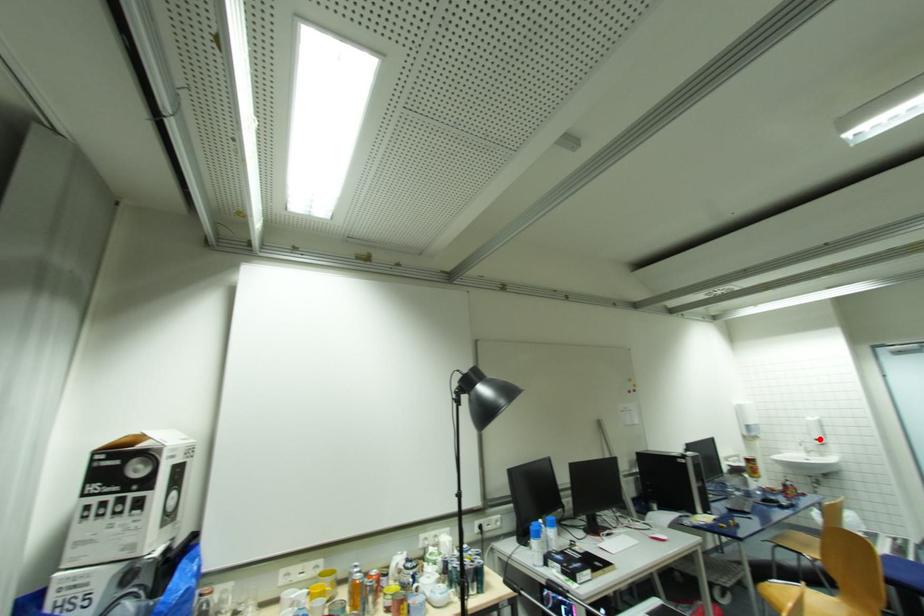
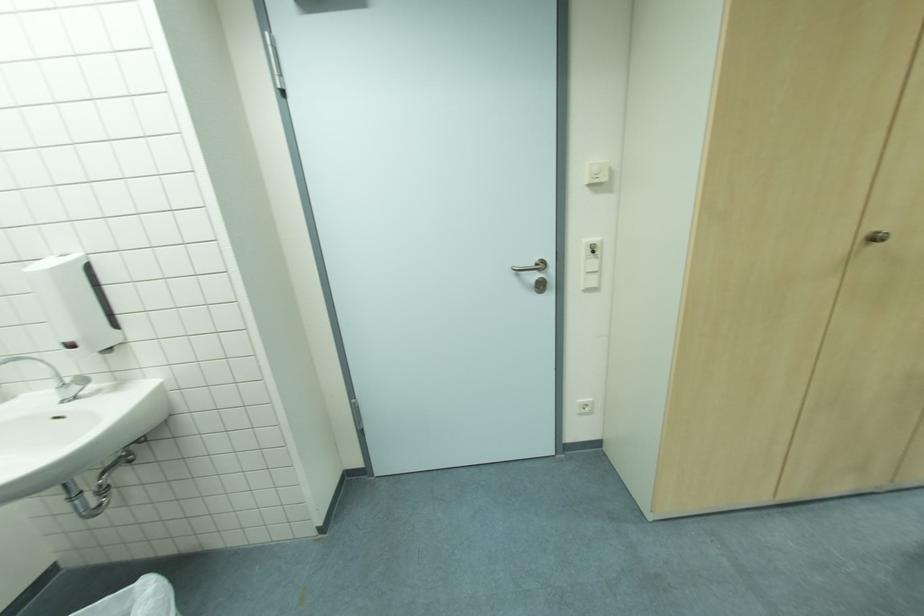
Question: I am providing you with two images of the same scene from different viewpoints. Image1 has a red point marked. In image2, the corresponding 3D location appears at what relative position? Reply with the corresponding letter.

Choices:
 (A) Closer
 (B) Farther

Answer: (B)